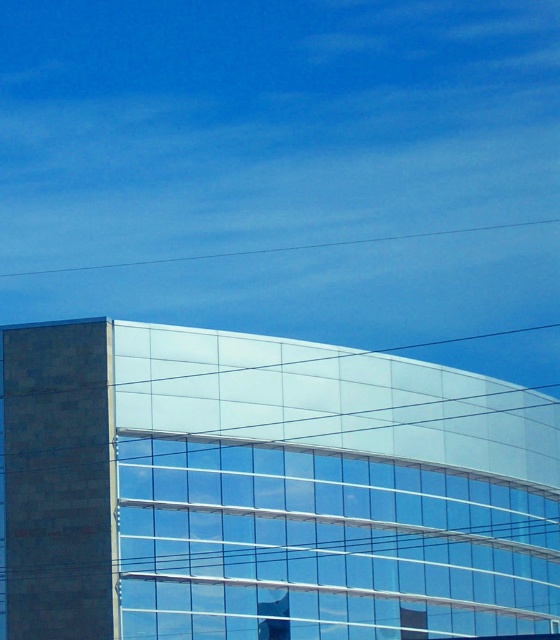
Based on the photo, can you confirm if transparent glass window at center is positioned to the left of metallic glass window at center?

No, transparent glass window at center is not to the left of metallic glass window at center.

Which of these two, transparent glass window at center or metallic glass window at center, stands taller?

transparent glass window at center is taller.

Is point (292, 472) farther from viewer compared to point (286, 627)?

That is True.

The height and width of the screenshot is (640, 560). Find the location of `transparent glass window at center`. transparent glass window at center is located at coordinates (325, 544).